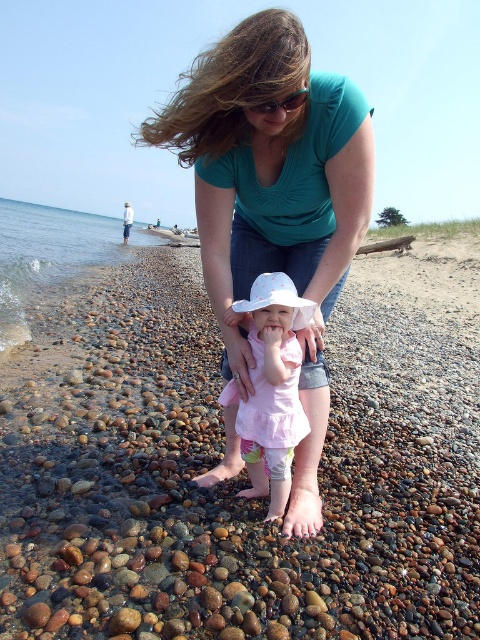
Question: Which point is farther to the camera?

Choices:
 (A) matte teal shirt at center
 (B) pink fabric dress at center
 (C) clear water at lower left

Answer: (C)

Question: Is matte teal shirt at center bigger than pink fabric dress at center?

Choices:
 (A) no
 (B) yes

Answer: (B)

Question: Which point is closer to the camera taking this photo?

Choices:
 (A) (94, 264)
 (B) (250, 433)
 (C) (228, 218)

Answer: (C)

Question: Which of the following is the closest to the observer?

Choices:
 (A) pink fabric dress at center
 (B) matte teal shirt at center
 (C) clear water at lower left

Answer: (B)

Question: Is matte teal shirt at center wider than pink fabric dress at center?

Choices:
 (A) yes
 (B) no

Answer: (A)

Question: Is matte teal shirt at center to the right of clear water at lower left from the viewer's perspective?

Choices:
 (A) yes
 (B) no

Answer: (A)